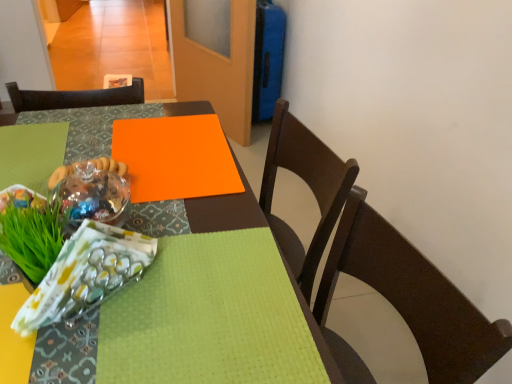
The image size is (512, 384). I want to click on blank space situated above orange matte board at center (from a real-world perspective), so click(x=176, y=151).